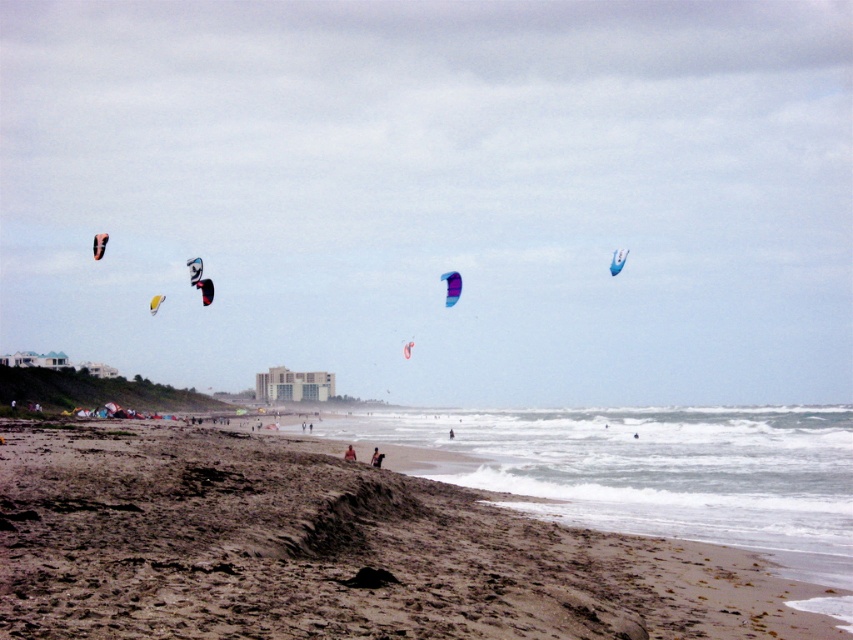
You are standing at the beach and want to walk from point A to point B. The coordinates for point A are point (618,262) and for point B are point (345,452). Which direction should you walk to get from point A to point B?

To move from point A to point B, you should walk towards the direction where point B is located, which is in front of point A since point A is behind point B according to their coordinates.

You are a photographer wanting to capture both the blue glossy parachute at upper center and the brown leather jacket at center in a single frame. Which object would you need to adjust your camera angle to include more of due to its larger size?

The blue glossy parachute at upper center is wider than the brown leather jacket at center, so you would need to adjust your camera angle to include more of the blue glossy parachute at upper center.